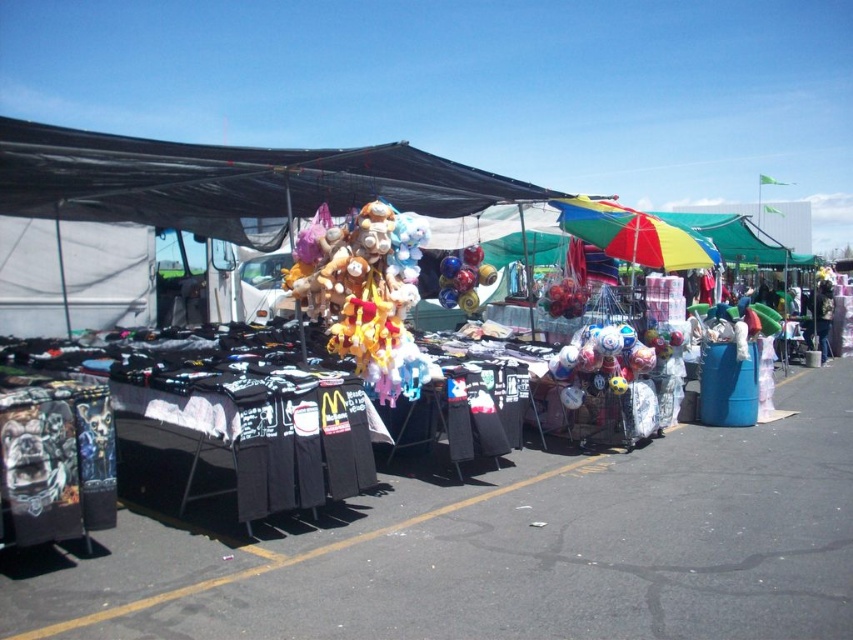
Between fluffy plush toys at center and fluffy plush at center, which one appears on the left side from the viewer's perspective?

fluffy plush toys at center

Between fluffy plush toys at center and fluffy plush at center, which one is positioned higher?

fluffy plush toys at center

Does point (355, 324) come closer to viewer compared to point (819, 285)?

That is True.

Identify the location of fluffy plush toys at center. Image resolution: width=853 pixels, height=640 pixels. (364, 291).

Is fluffy plush toys at center smaller than rainbow fabric umbrella at center?

Yes, fluffy plush toys at center is smaller than rainbow fabric umbrella at center.

Does fluffy plush toys at center have a greater height compared to rainbow fabric umbrella at center?

Yes, fluffy plush toys at center is taller than rainbow fabric umbrella at center.

Is point (332, 333) positioned before point (561, 204)?

That is True.

Identify the location of fluffy plush toys at center. The image size is (853, 640). (364, 291).

Does black fabric t-shirts at center have a lesser height compared to fluffy plush toys at center?

Correct, black fabric t-shirts at center is not as tall as fluffy plush toys at center.

This screenshot has height=640, width=853. What are the coordinates of `black fabric t-shirts at center` in the screenshot? It's located at (227, 180).

The image size is (853, 640). Describe the element at coordinates (227, 180) in the screenshot. I see `black fabric t-shirts at center` at that location.

Where is `black fabric t-shirts at center`? The image size is (853, 640). black fabric t-shirts at center is located at coordinates (227, 180).